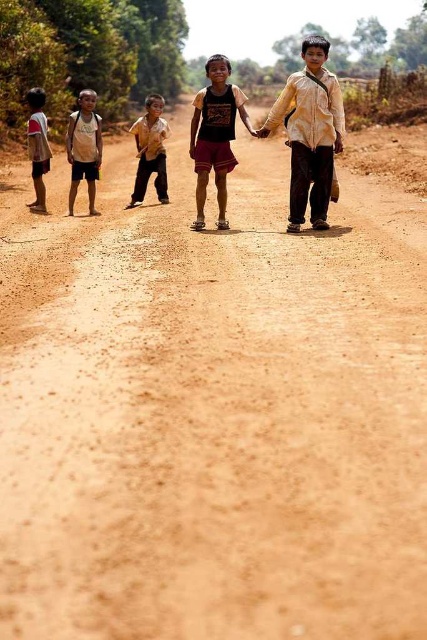
You are a photographer trying to capture a group of children walking along a dirt road. You notice two children wearing yellow cotton shirt at center and brown cotton shirt at center. Since you want to ensure both are visible in the photo, which child should you focus on to capture their full height?

Result: The yellow cotton shirt at center is much taller than the brown cotton shirt at center, so focusing on the yellow cotton shirt at center would ensure both are visible as the taller child requires more space in the frame.

You are a photographer trying to capture the children in the scene. You notice the yellow cotton shirt at center and the dark brown cotton shorts at center. Which clothing item is positioned closer to your camera lens?

The yellow cotton shirt at center is closer to the viewer than dark brown cotton shorts at center, so the yellow cotton shirt at center would be the one closer to your camera lens.

You are a photographer trying to capture a group of children walking along a dirt road. You notice two children wearing yellow cotton shirt at center and brown cotton shirt at center. Which child is standing in front from your viewpoint?

The yellow cotton shirt at center is positioned under the brown cotton shirt at center, meaning the brown cotton shirt at center is in front since it covers part of the yellow one from the viewer perspective.